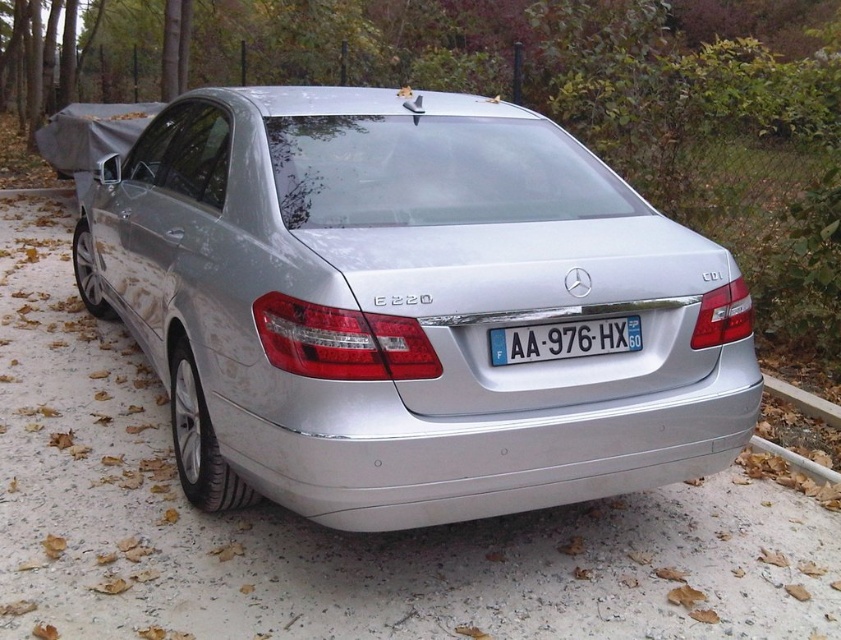
You are standing in a parking lot and see the white plastic license plate at center on a car. If you want to read the license plate text without moving closer, what is the minimum magnification power needed for a magnifying glass to clearly see the text from your current position?

The white plastic license plate at center is 7.91 feet away. To read the text clearly from that distance, a magnifying glass with at least 3x magnification power would be required.

You are a delivery driver who needs to park your vehicle in a space that requires the license plate to be visible and the front bumper to align with the curb. Based on the scene, will the white plastic license plate at center be visible when the gray concrete curb at lower right is aligned with your front bumper?

The white plastic license plate at center has a greater width than the gray concrete curb at lower right. Therefore, when aligning the front bumper with the curb, the license plate will still be visible since it extends wider than the curb.

You are a parking attendant checking if vehicles are properly parked. The silver metallic car at center is parked on the gray concrete curb at lower right. Is this a correct parking position according to standard parking regulations?

The silver metallic car at center is positioned over the gray concrete curb at lower right, which violates standard parking regulations as vehicles should not be parked on curbs to avoid damage and ensure safety.